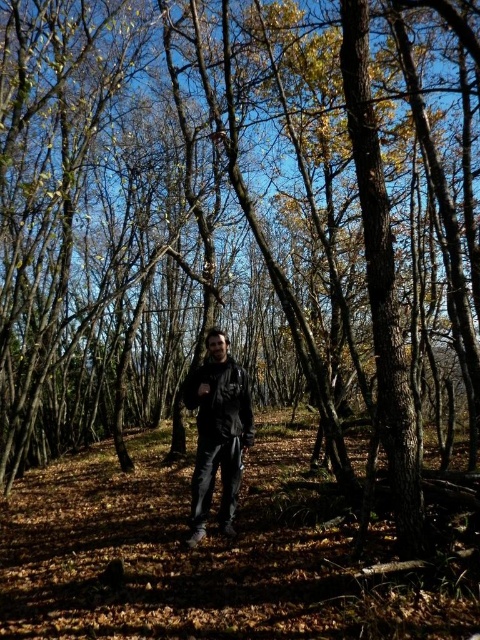
Question: Is matte black jacket at center above leather jacket at center?

Choices:
 (A) yes
 (B) no

Answer: (B)

Question: Is matte black jacket at center to the left of leather jacket at center from the viewer's perspective?

Choices:
 (A) yes
 (B) no

Answer: (A)

Question: Is matte black jacket at center bigger than leather jacket at center?

Choices:
 (A) yes
 (B) no

Answer: (A)